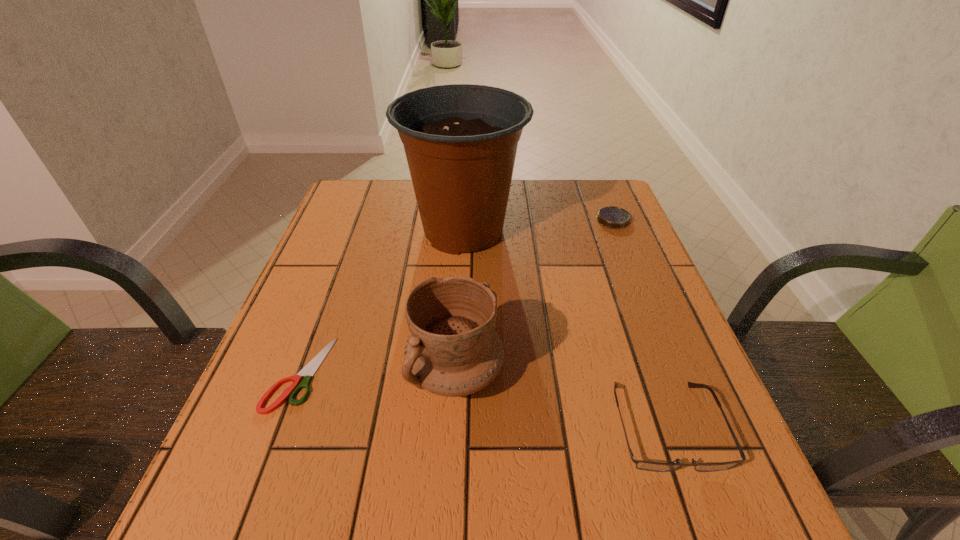
The image size is (960, 540). I want to click on flowerpot that is at the far edge, so click(460, 140).

Identify the location of compass at the far edge. The height and width of the screenshot is (540, 960). (612, 217).

Locate an element on the screen. object situated at the left edge is located at coordinates (309, 370).

Image resolution: width=960 pixels, height=540 pixels. In order to click on spectacles present at the right edge in this screenshot , I will do `click(640, 464)`.

Where is `compass that is at the right edge`? This screenshot has width=960, height=540. compass that is at the right edge is located at coordinates (612, 217).

The width and height of the screenshot is (960, 540). I want to click on object that is at the far right corner, so click(x=612, y=217).

Find the location of a particular element. The image size is (960, 540). free space at the far edge of the desktop is located at coordinates (517, 181).

Image resolution: width=960 pixels, height=540 pixels. In the image, there is a desktop. What are the coordinates of `vacant region at the near edge` in the screenshot? It's located at (377, 534).

Locate an element on the screen. The width and height of the screenshot is (960, 540). vacant space at the left edge of the desktop is located at coordinates (306, 324).

You are a GUI agent. You are given a task and a screenshot of the screen. Output one action in this format:
    pyautogui.click(x=<x>, y=<y>)
    Task: Click on the vacant space at the right edge of the desktop
    
    Given the screenshot: What is the action you would take?
    pyautogui.click(x=667, y=392)